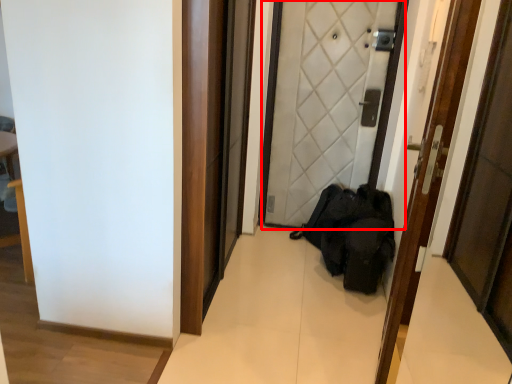
Question: Observing the image, what is the correct spatial positioning of door (annotated by the red box) in reference to door?

Choices:
 (A) left
 (B) right

Answer: (A)